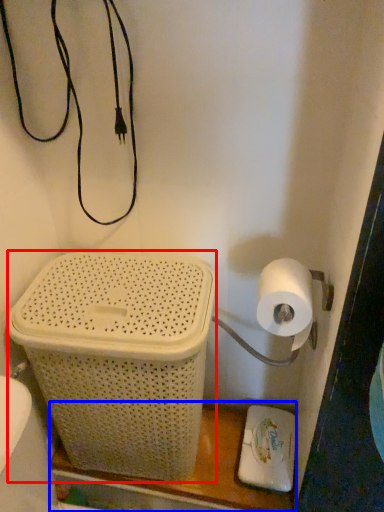
Question: Which object is further to the camera taking this photo, basket container (highlighted by a red box) or shelf (highlighted by a blue box)?

Choices:
 (A) basket container
 (B) shelf

Answer: (B)